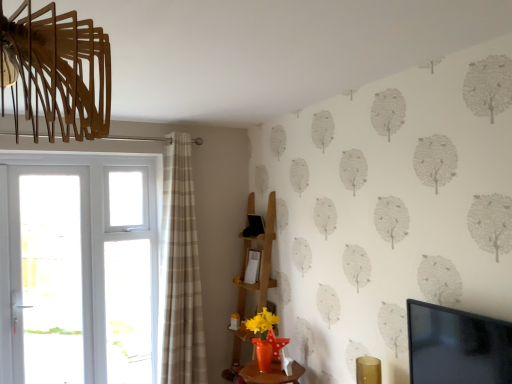
Question: Is wooden shelf at center at the left side of beige plaid curtain at left?

Choices:
 (A) no
 (B) yes

Answer: (A)

Question: From the image's perspective, is wooden shelf at center under beige plaid curtain at left?

Choices:
 (A) no
 (B) yes

Answer: (B)

Question: Does wooden shelf at center come in front of beige plaid curtain at left?

Choices:
 (A) no
 (B) yes

Answer: (A)

Question: Is the position of wooden shelf at center more distant than that of beige plaid curtain at left?

Choices:
 (A) yes
 (B) no

Answer: (A)

Question: Is wooden shelf at center directly adjacent to beige plaid curtain at left?

Choices:
 (A) no
 (B) yes

Answer: (A)

Question: From their relative heights in the image, would you say black glossy tv at upper right is taller or shorter than white plastic door at left?

Choices:
 (A) tall
 (B) short

Answer: (B)

Question: Considering the positions of point (424, 336) and point (88, 284), is point (424, 336) closer or farther from the camera than point (88, 284)?

Choices:
 (A) closer
 (B) farther

Answer: (A)

Question: Is black glossy tv at upper right inside or outside of white plastic door at left?

Choices:
 (A) outside
 (B) inside

Answer: (A)

Question: Is black glossy tv at upper right to the left or to the right of white plastic door at left in the image?

Choices:
 (A) left
 (B) right

Answer: (B)

Question: Considering the positions of white plastic door at left and wooden shelf at center in the image, is white plastic door at left wider or thinner than wooden shelf at center?

Choices:
 (A) wide
 (B) thin

Answer: (B)

Question: Is point (53, 170) positioned closer to the camera than point (269, 236)?

Choices:
 (A) farther
 (B) closer

Answer: (B)

Question: Is white plastic door at left to the left or to the right of wooden shelf at center in the image?

Choices:
 (A) right
 (B) left

Answer: (B)

Question: From their relative heights in the image, would you say white plastic door at left is taller or shorter than wooden shelf at center?

Choices:
 (A) tall
 (B) short

Answer: (A)

Question: Considering the positions of white glass screen door at left and beige plaid curtain at left in the image, is white glass screen door at left bigger or smaller than beige plaid curtain at left?

Choices:
 (A) big
 (B) small

Answer: (B)

Question: Considering their positions, is white glass screen door at left located in front of or behind beige plaid curtain at left?

Choices:
 (A) front
 (B) behind

Answer: (B)